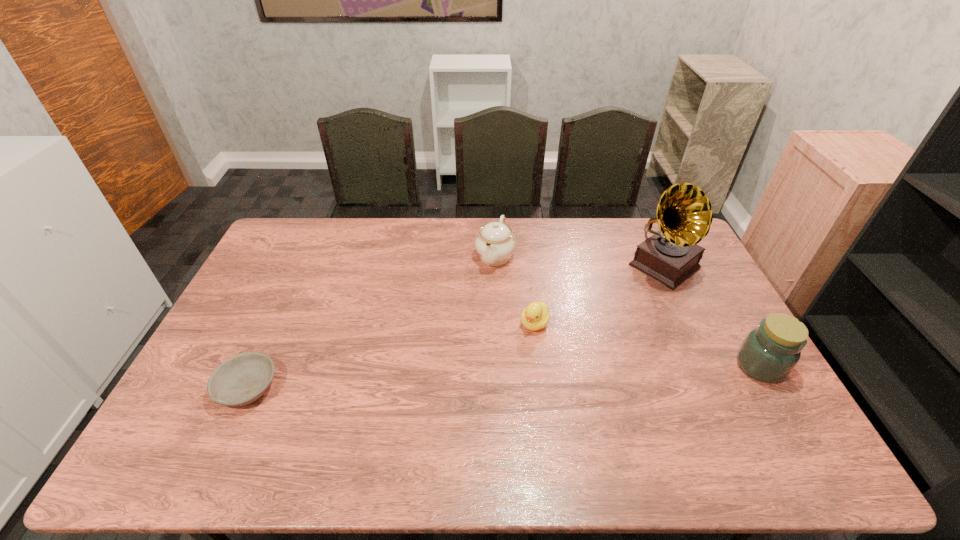
This screenshot has height=540, width=960. I want to click on the shortest object, so click(x=242, y=379).

You are a GUI agent. You are given a task and a screenshot of the screen. Output one action in this format:
    pyautogui.click(x=<x>, y=<y>)
    Task: Click on the bowl
    This screenshot has width=960, height=540.
    Given the screenshot: What is the action you would take?
    pyautogui.click(x=242, y=379)

Locate an element on the screen. This screenshot has height=540, width=960. jar is located at coordinates (769, 353).

Locate an element on the screen. This screenshot has width=960, height=540. chinaware is located at coordinates (495, 243).

Where is `duckling`? This screenshot has width=960, height=540. duckling is located at coordinates (535, 316).

The width and height of the screenshot is (960, 540). I want to click on the fourth tallest object, so click(x=535, y=316).

Identify the location of the tallest object. This screenshot has width=960, height=540. (671, 255).

The height and width of the screenshot is (540, 960). What are the coordinates of `free region located 0.200m on the back of the leftmost object` in the screenshot? It's located at (282, 312).

Find the location of a particular element. This screenshot has height=540, width=960. vacant space located on the left of the jar is located at coordinates click(x=680, y=366).

At what (x,y) coordinates should I click in order to perform the action: click on free space located at the spout of the chinaware. Please return your answer as a coordinate pair (x, y). Looking at the image, I should click on click(x=479, y=300).